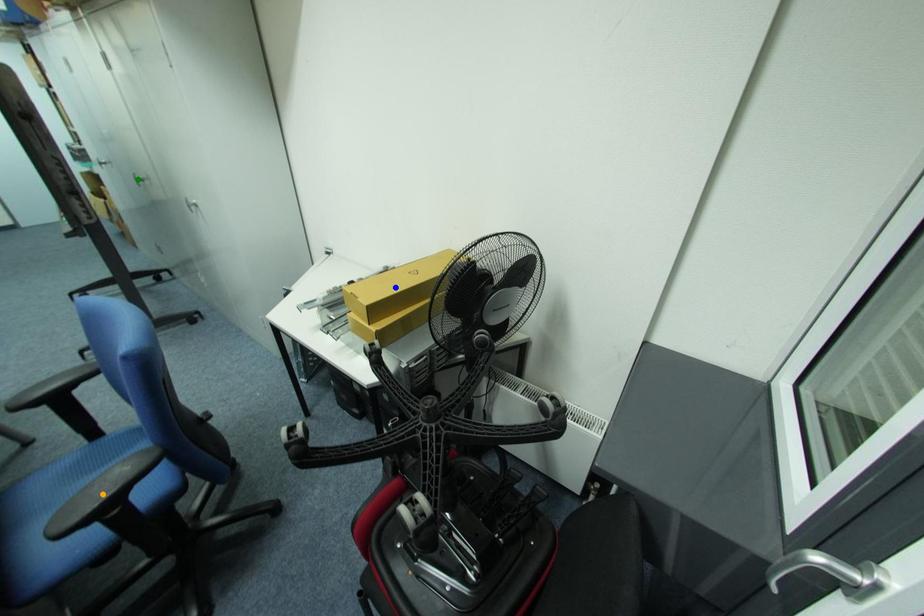
Order these from nearest to farthest:
green point
blue point
orange point

orange point → blue point → green point